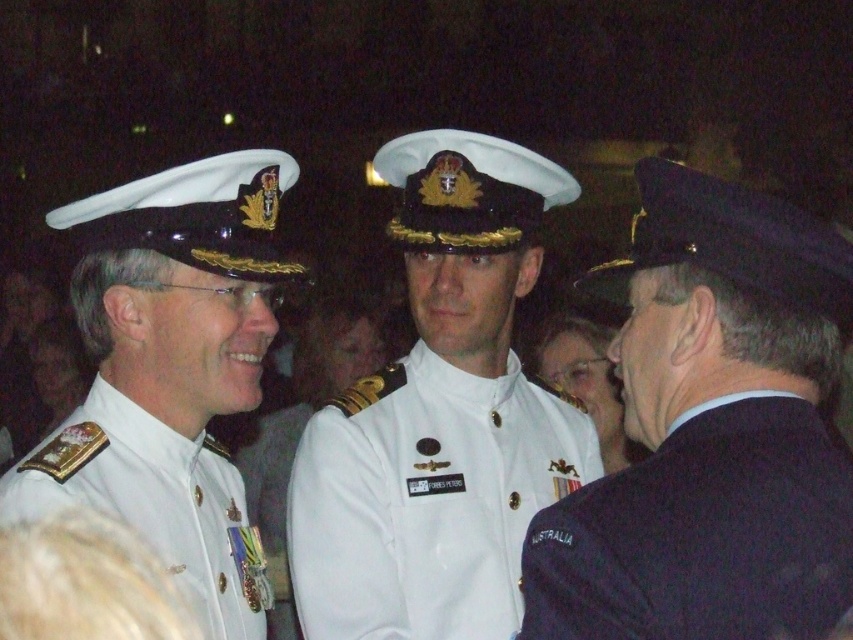
Where is `white matte uniform at center`? white matte uniform at center is located at coordinates (427, 499).

Is point (387, 458) farther from viewer compared to point (672, 628)?

Yes.

The height and width of the screenshot is (640, 853). I want to click on white matte uniform at center, so (427, 499).

At what (x,y) coordinates should I click in order to perform the action: click on white matte uniform at center. Please return your answer as a coordinate pair (x, y). This screenshot has width=853, height=640. Looking at the image, I should click on (427, 499).

Which is more to the left, white glossy uniform at center or dark blue wool blazer at right?

white glossy uniform at center

Is white glossy uniform at center thinner than dark blue wool blazer at right?

No.

Between point (212, 300) and point (704, 451), which one is positioned behind?

Positioned behind is point (212, 300).

Find the location of a particular element. This screenshot has width=853, height=640. white glossy uniform at center is located at coordinates (171, 369).

Does white glossy uniform at center have a smaller size compared to white matte uniform at center?

Yes, white glossy uniform at center is smaller than white matte uniform at center.

Is white glossy uniform at center thinner than white matte uniform at center?

Yes.

Measure the distance between point (97, 387) and camera.

2.62 meters

Find the location of `white glossy uniform at center`. white glossy uniform at center is located at coordinates tap(171, 369).